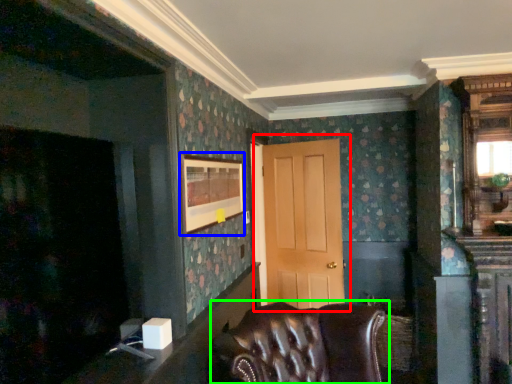
Question: Considering the real-world distances, which object is farthest from door (highlighted by a red box)? picture frame (highlighted by a blue box) or chair (highlighted by a green box)?

Choices:
 (A) picture frame
 (B) chair

Answer: (B)